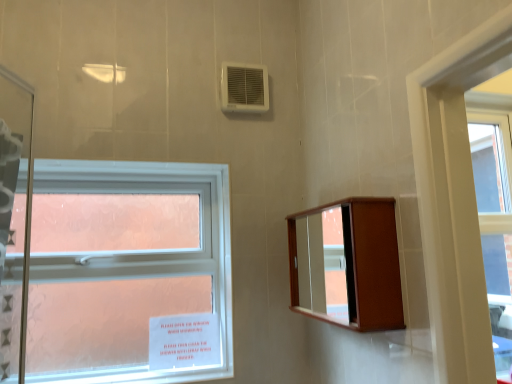
Question: Considering the relative sizes of white plastic air conditioning unit at upper center and wooden medicine cabinet at upper right in the image provided, is white plastic air conditioning unit at upper center shorter than wooden medicine cabinet at upper right?

Choices:
 (A) yes
 (B) no

Answer: (A)

Question: Does white plastic air conditioning unit at upper center have a larger size compared to wooden medicine cabinet at upper right?

Choices:
 (A) no
 (B) yes

Answer: (A)

Question: Considering the relative sizes of white plastic air conditioning unit at upper center and wooden medicine cabinet at upper right in the image provided, is white plastic air conditioning unit at upper center wider than wooden medicine cabinet at upper right?

Choices:
 (A) no
 (B) yes

Answer: (A)

Question: From a real-world perspective, is white plastic air conditioning unit at upper center positioned under wooden medicine cabinet at upper right based on gravity?

Choices:
 (A) yes
 (B) no

Answer: (B)

Question: Is white plastic air conditioning unit at upper center looking in the opposite direction of wooden medicine cabinet at upper right?

Choices:
 (A) no
 (B) yes

Answer: (A)

Question: From a real-world perspective, is white plastic air conditioning unit at upper center located higher than wooden medicine cabinet at upper right?

Choices:
 (A) yes
 (B) no

Answer: (A)

Question: Is wooden medicine cabinet at upper right bigger than white plastic air conditioning unit at upper center?

Choices:
 (A) yes
 (B) no

Answer: (A)

Question: Does wooden medicine cabinet at upper right have a greater height compared to white plastic air conditioning unit at upper center?

Choices:
 (A) no
 (B) yes

Answer: (B)

Question: Can you confirm if wooden medicine cabinet at upper right is positioned to the left of white plastic air conditioning unit at upper center?

Choices:
 (A) no
 (B) yes

Answer: (A)

Question: Is wooden medicine cabinet at upper right positioned behind white plastic air conditioning unit at upper center?

Choices:
 (A) yes
 (B) no

Answer: (B)

Question: Is wooden medicine cabinet at upper right to the right of white plastic air conditioning unit at upper center from the viewer's perspective?

Choices:
 (A) yes
 (B) no

Answer: (A)

Question: Does wooden medicine cabinet at upper right have a lesser width compared to white plastic air conditioning unit at upper center?

Choices:
 (A) yes
 (B) no

Answer: (B)

Question: From the image's perspective, would you say wooden medicine cabinet at upper right is shown under clear glass window at left?

Choices:
 (A) no
 (B) yes

Answer: (A)